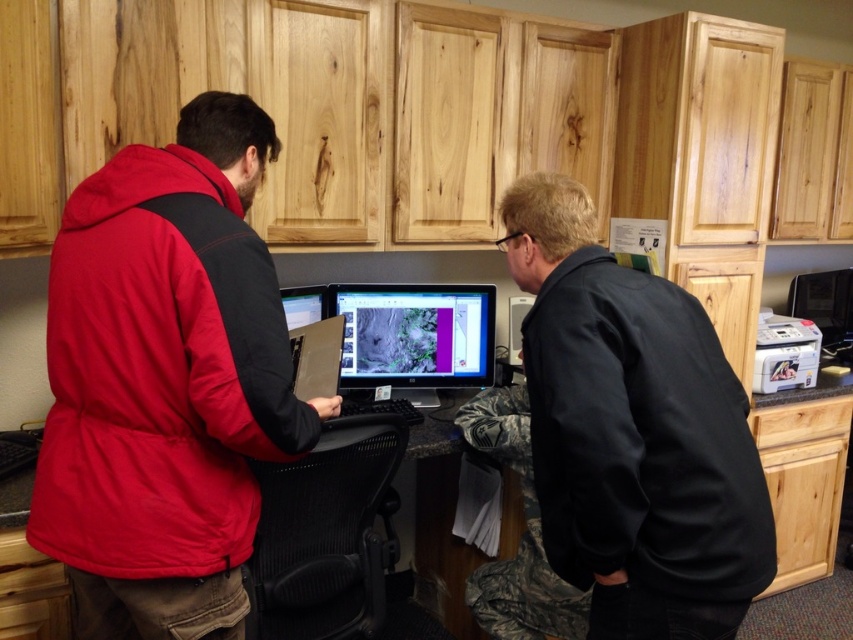
Question: Which point appears farthest from the camera in this image?

Choices:
 (A) (242, 348)
 (B) (483, 358)

Answer: (B)

Question: Can you confirm if matte red jacket at left is positioned to the right of black smooth jacket at lower right?

Choices:
 (A) no
 (B) yes

Answer: (A)

Question: Does matte red jacket at left have a greater width compared to black smooth jacket at lower right?

Choices:
 (A) no
 (B) yes

Answer: (B)

Question: Which point is farther to the camera?

Choices:
 (A) pyautogui.click(x=624, y=504)
 (B) pyautogui.click(x=445, y=356)
 (C) pyautogui.click(x=77, y=296)

Answer: (B)

Question: Is matte red jacket at left positioned in front of matte black monitor at center?

Choices:
 (A) yes
 (B) no

Answer: (A)

Question: Which object is positioned closest to the matte black monitor at center?

Choices:
 (A) matte red jacket at left
 (B) black smooth jacket at lower right

Answer: (A)